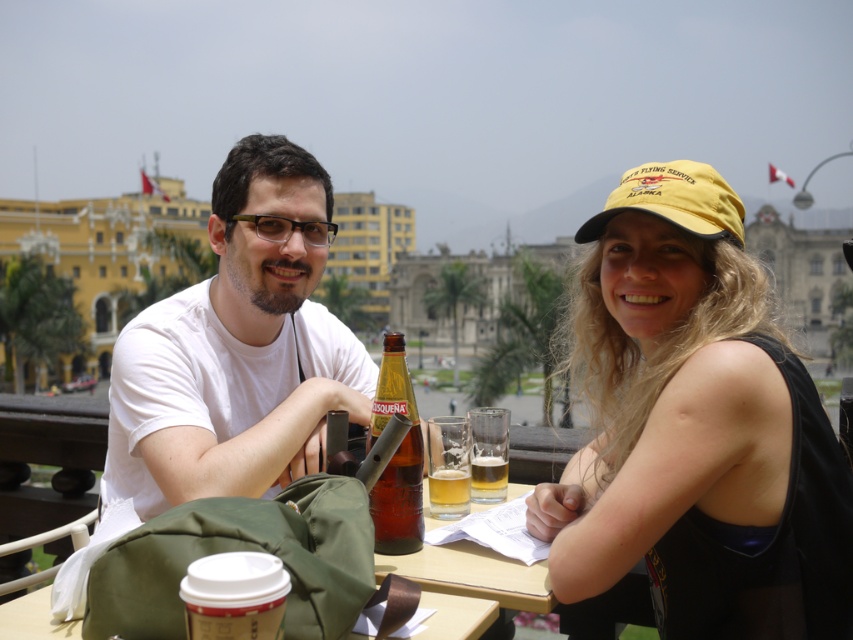
Does matte plastic cup at lower center appear on the left side of translucent glass beer at center?

Indeed, matte plastic cup at lower center is positioned on the left side of translucent glass beer at center.

Can you confirm if matte plastic cup at lower center is shorter than translucent glass beer at center?

Yes.

Measure the distance between matte plastic cup at lower center and camera.

matte plastic cup at lower center and camera are 136.58 feet apart.

Identify the location of matte plastic cup at lower center. The image size is (853, 640). (456, 616).

Is yellow fabric cap at upper right wider than white matte shirt at center?

In fact, yellow fabric cap at upper right might be narrower than white matte shirt at center.

Does point (724, 198) lie in front of point (210, 228)?

Yes, it is.

The height and width of the screenshot is (640, 853). I want to click on yellow fabric cap at upper right, so click(695, 428).

Is white matte t-shirt at center to the left of yellow fabric baseball cap at upper right from the viewer's perspective?

Correct, you'll find white matte t-shirt at center to the left of yellow fabric baseball cap at upper right.

Does white matte t-shirt at center have a larger size compared to yellow fabric baseball cap at upper right?

Yes, white matte t-shirt at center is bigger than yellow fabric baseball cap at upper right.

Find the location of `white matte t-shirt at center`. white matte t-shirt at center is located at coordinates (697, 448).